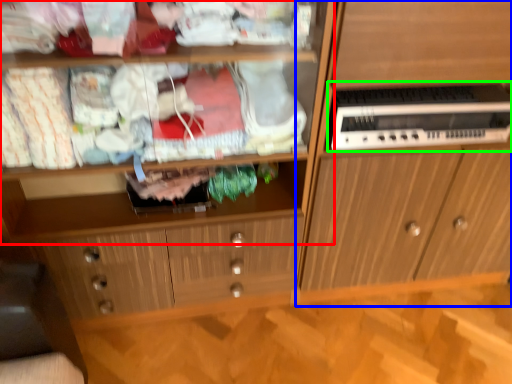
Question: Which object is positioned closest to shelf (highlighted by a red box)? Select from cabinetry (highlighted by a blue box) and home appliance (highlighted by a green box).

Choices:
 (A) cabinetry
 (B) home appliance

Answer: (A)